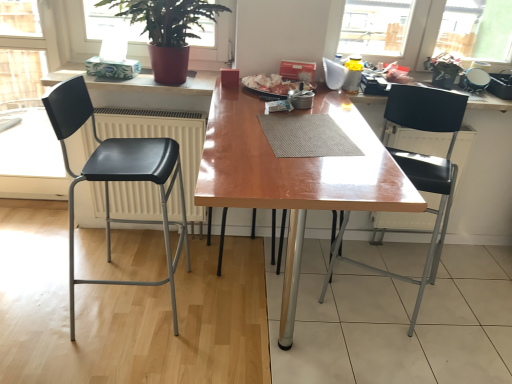
This screenshot has width=512, height=384. What are the coordinates of `vacant point to the right of black plastic chair at right, which is the 2th chair in left-to-right order` in the screenshot? It's located at (463, 307).